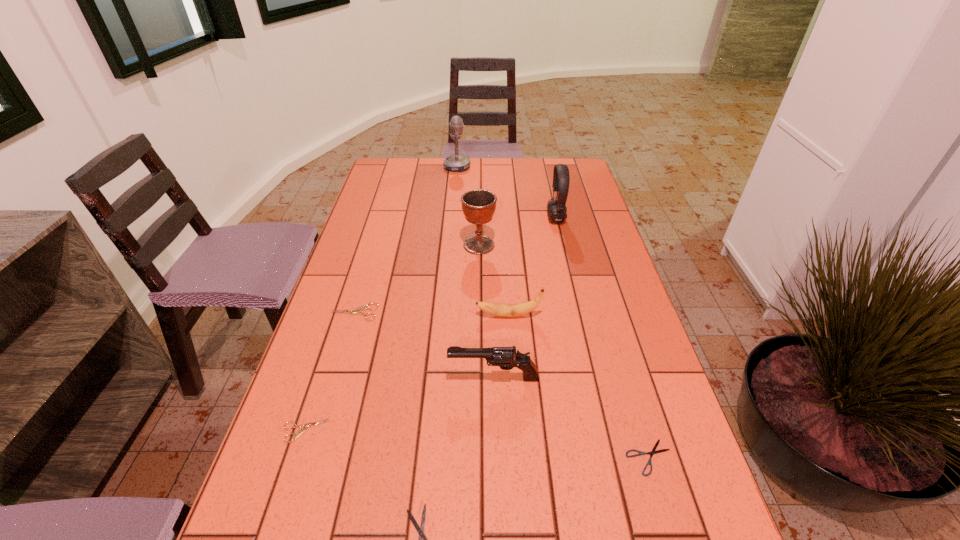
At what (x,y) coordinates should I click in order to perform the action: click on free space at the left edge. Please return your answer as a coordinate pair (x, y). Looking at the image, I should click on (302, 482).

In order to click on vacant area at the right edge of the desktop in this screenshot , I will do `click(582, 286)`.

At what (x,y) coordinates should I click in order to perform the action: click on unoccupied area between the farthest shears and the gun. Please return your answer as a coordinate pair (x, y). This screenshot has height=540, width=960. Looking at the image, I should click on (424, 345).

The height and width of the screenshot is (540, 960). I want to click on free spot between the fourth nearest object and the farthest object, so coord(475,273).

The height and width of the screenshot is (540, 960). What are the coordinates of `vacant region between the rightmost shears and the microphone` in the screenshot? It's located at (553, 312).

Locate an element on the screen. empty location between the gun and the fifth tallest object is located at coordinates (501, 347).

Locate an element on the screen. This screenshot has height=540, width=960. vacant space that's between the nearer beige shears and the yellow banana is located at coordinates (407, 373).

Image resolution: width=960 pixels, height=540 pixels. I want to click on unoccupied area between the smaller beige shears and the chalice, so click(x=392, y=338).

Locate an element on the screen. free point between the microphone and the headset is located at coordinates (507, 193).

The height and width of the screenshot is (540, 960). I want to click on free space between the sixth tallest object and the smaller beige shears, so coord(329,372).